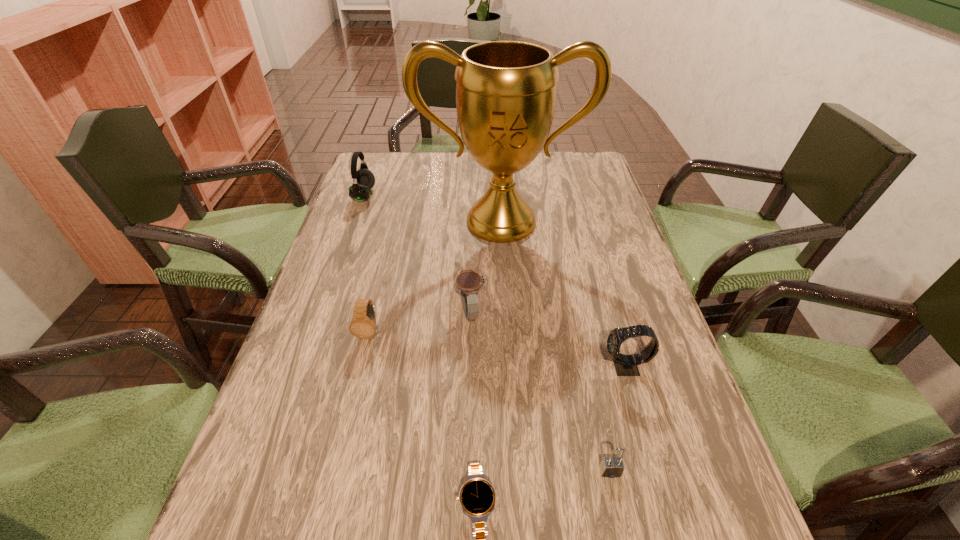
This screenshot has width=960, height=540. Find the location of `the tallest object`. the tallest object is located at coordinates (506, 91).

This screenshot has height=540, width=960. In order to click on the sixth shortest object in this screenshot , I will do `click(363, 180)`.

The width and height of the screenshot is (960, 540). I want to click on headset, so click(363, 180).

Where is `the rightmost watch`? The width and height of the screenshot is (960, 540). the rightmost watch is located at coordinates (625, 365).

Find the location of a particular element. This screenshot has width=960, height=540. the third nearest object is located at coordinates (625, 365).

Image resolution: width=960 pixels, height=540 pixels. Identify the location of the second object from left to right. (363, 324).

The image size is (960, 540). I want to click on the sixth tallest object, so click(x=611, y=467).

The image size is (960, 540). Identify the location of free point located 0.310m on the surface of the trophy cup with symbols. (508, 336).

The width and height of the screenshot is (960, 540). I want to click on vacant space located on the ear cups of the leftmost object, so click(x=457, y=195).

What are the coordinates of `vacant region located 0.210m on the face of the third nearest object` in the screenshot? It's located at (501, 367).